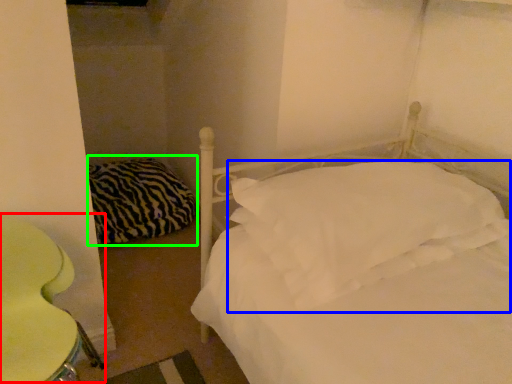
Question: Based on their relative distances, which object is nearer to swivel chair (highlighted by a red box)? Choose from pillow (highlighted by a blue box) and pillow (highlighted by a green box).

Choices:
 (A) pillow
 (B) pillow

Answer: (A)